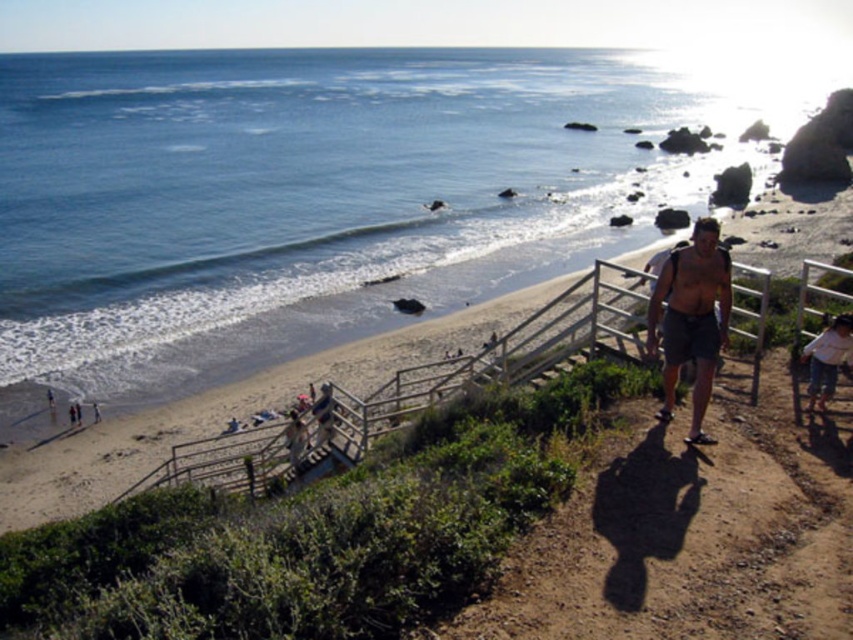
Consider the image. You are standing at the dirt path bordered by a metal railing and green shrubs. You see a man walking along the path and notice a point at coordinates (827, 358). What object is located at that point?

The point at coordinates (827, 358) corresponds to the white cotton shirt at lower right.

You are a photographer trying to capture the man walking on the beach. The gray shorts at right and white cotton shirt at lower right are visible in your frame. Which clothing item appears bigger in your photo?

The gray shorts at right appears bigger in the photo than the white cotton shirt at lower right because it has a larger size.